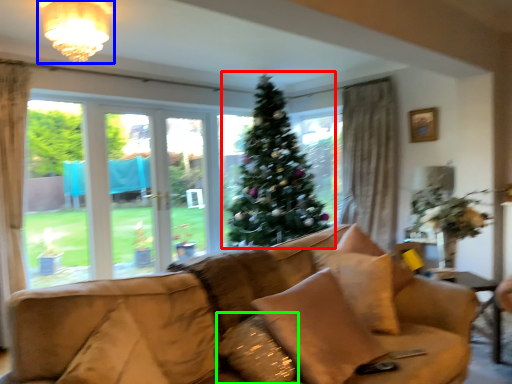
Question: Which object is the closest to the christmas tree (highlighted by a red box)? Choose among these: light fixture (highlighted by a blue box) or pillow (highlighted by a green box).

Choices:
 (A) light fixture
 (B) pillow

Answer: (A)